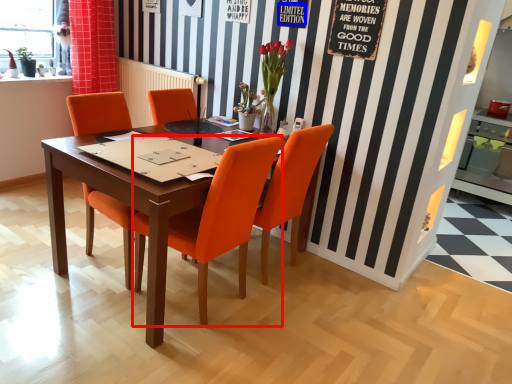
Question: Which of the following is the farthest to the observer, chair (highlighted by a red box) or writing (highlighted by a blue box)?

Choices:
 (A) chair
 (B) writing

Answer: (B)